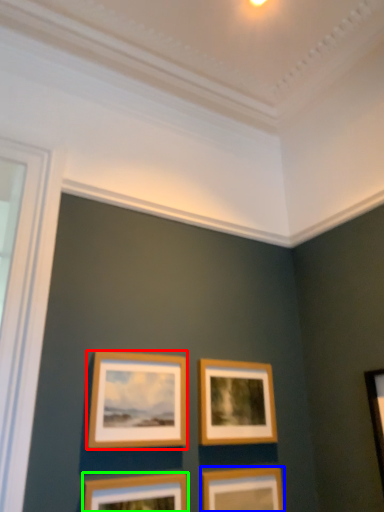
Question: Considering the real-world distances, which object is closest to picture frame (highlighted by a red box)? picture frame (highlighted by a blue box) or picture frame (highlighted by a green box).

Choices:
 (A) picture frame
 (B) picture frame

Answer: (B)